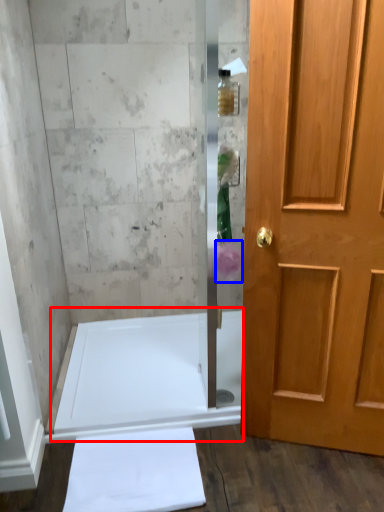
Question: Which object appears closest to the camera in this image, bath (highlighted by a red box) or flower (highlighted by a blue box)?

Choices:
 (A) bath
 (B) flower

Answer: (B)